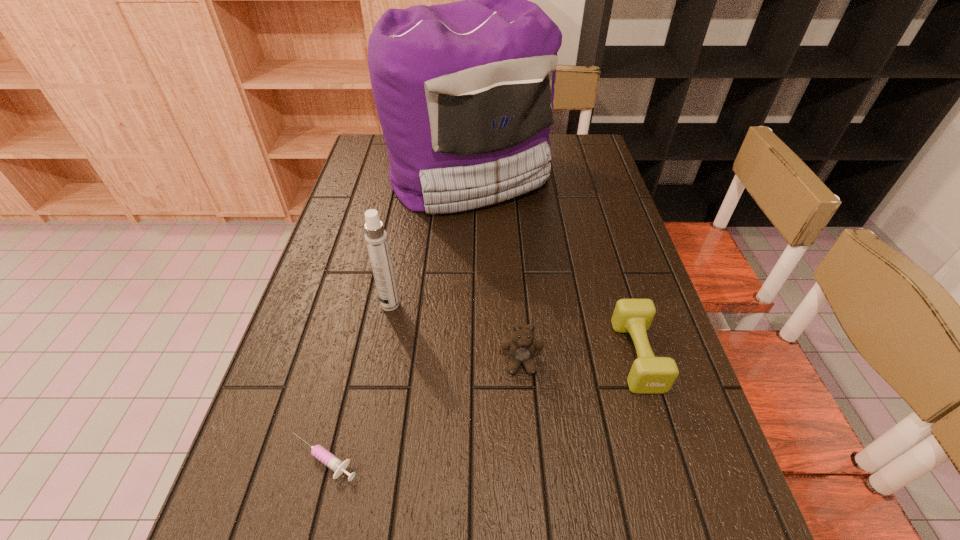
Locate an element on the screen. The width and height of the screenshot is (960, 540). the tallest object is located at coordinates (464, 91).

This screenshot has width=960, height=540. I want to click on backpack, so click(464, 91).

Find the location of a particular element. This screenshot has height=540, width=960. the fourth shortest object is located at coordinates (376, 238).

Find the location of a particular element. Image resolution: width=960 pixels, height=540 pixels. aerosol can is located at coordinates (376, 238).

This screenshot has height=540, width=960. What are the coordinates of `the third shortest object` in the screenshot? It's located at (522, 346).

Locate an element on the screen. This screenshot has height=540, width=960. the rightmost object is located at coordinates (649, 375).

Find the location of a particular element. This screenshot has width=960, height=540. the fourth tallest object is located at coordinates (649, 375).

You are a GUI agent. You are given a task and a screenshot of the screen. Output one action in this format:
    pyautogui.click(x=<x>, y=<y>)
    Task: Click on the nearest object
    The height and width of the screenshot is (540, 960).
    Given the screenshot: What is the action you would take?
    pyautogui.click(x=319, y=452)

The width and height of the screenshot is (960, 540). Find the location of `syringe`. syringe is located at coordinates click(319, 452).

At what (x,y) coordinates should I click in order to perform the action: click on vacant space situated on the front pocket of the backpack. Please return your answer as a coordinate pair (x, y). Looking at the image, I should click on (467, 256).